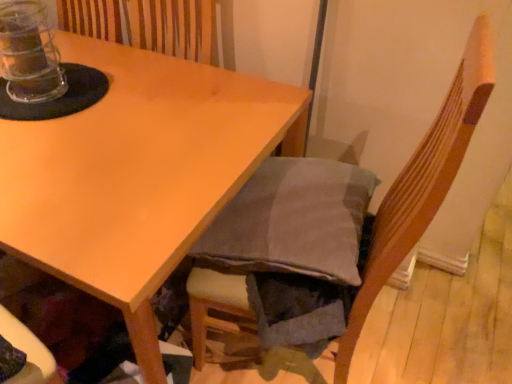
Question: Is transparent plastic jar at top left next to dark gray fabric chair at lower right and touching it?

Choices:
 (A) no
 (B) yes

Answer: (A)

Question: Is transparent plastic jar at top left far from dark gray fabric chair at lower right?

Choices:
 (A) no
 (B) yes

Answer: (A)

Question: Is transparent plastic jar at top left at the left side of dark gray fabric chair at lower right?

Choices:
 (A) no
 (B) yes

Answer: (B)

Question: Is transparent plastic jar at top left looking in the opposite direction of dark gray fabric chair at lower right?

Choices:
 (A) no
 (B) yes

Answer: (A)

Question: Considering the relative sizes of transparent plastic jar at top left and dark gray fabric chair at lower right in the image provided, is transparent plastic jar at top left bigger than dark gray fabric chair at lower right?

Choices:
 (A) no
 (B) yes

Answer: (A)

Question: Is dark gray fabric chair at lower right in front of or behind transparent plastic jar at top left in the image?

Choices:
 (A) front
 (B) behind

Answer: (A)

Question: From the image's perspective, is dark gray fabric chair at lower right above or below transparent plastic jar at top left?

Choices:
 (A) below
 (B) above

Answer: (A)

Question: Is dark gray fabric chair at lower right bigger or smaller than transparent plastic jar at top left?

Choices:
 (A) big
 (B) small

Answer: (A)

Question: Which is correct: dark gray fabric chair at lower right is inside transparent plastic jar at top left, or outside of it?

Choices:
 (A) inside
 (B) outside

Answer: (B)

Question: Is dark gray fabric chair at lower right in front of or behind matte wood table at upper left in the image?

Choices:
 (A) behind
 (B) front

Answer: (B)

Question: From the image's perspective, is dark gray fabric chair at lower right above or below matte wood table at upper left?

Choices:
 (A) below
 (B) above

Answer: (A)

Question: Is dark gray fabric chair at lower right situated inside matte wood table at upper left or outside?

Choices:
 (A) outside
 (B) inside

Answer: (A)

Question: Considering the positions of dark gray fabric chair at lower right and matte wood table at upper left in the image, is dark gray fabric chair at lower right bigger or smaller than matte wood table at upper left?

Choices:
 (A) small
 (B) big

Answer: (A)

Question: Is transparent plastic jar at top left in front of or behind dark gray fabric chair at lower right in the image?

Choices:
 (A) front
 (B) behind

Answer: (B)

Question: Is transparent plastic jar at top left to the left or to the right of dark gray fabric chair at lower right in the image?

Choices:
 (A) left
 (B) right

Answer: (A)